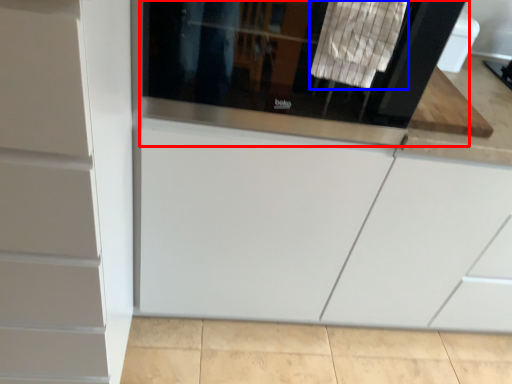
Question: Among these objects, which one is farthest to the camera, screen door (highlighted by a red box) or laundry (highlighted by a blue box)?

Choices:
 (A) screen door
 (B) laundry

Answer: (A)